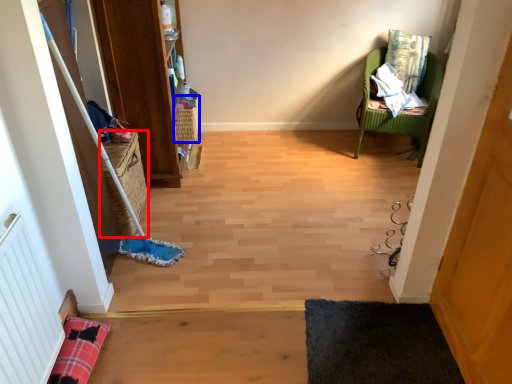
Question: Which object appears closest to the camera in this image, basket (highlighted by a red box) or basket (highlighted by a blue box)?

Choices:
 (A) basket
 (B) basket

Answer: (A)